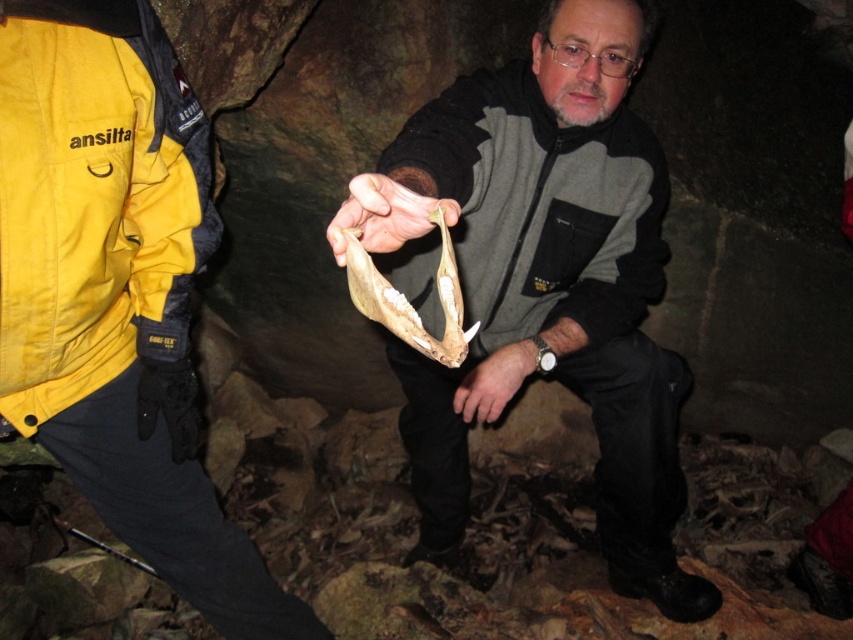
Question: Which point appears farthest from the camera in this image?

Choices:
 (A) (25, 419)
 (B) (372, 195)

Answer: (A)

Question: Which object appears closest to the camera in this image?

Choices:
 (A) matte bone at center
 (B) yellow fabric jacket at left
 (C) matte black jacket at center
 (D) smooth bone at center

Answer: (D)

Question: Which of these objects is positioned farthest from the matte black jacket at center?

Choices:
 (A) yellow fabric jacket at left
 (B) gray fleece jacket at center
 (C) smooth bone at center

Answer: (B)

Question: Is matte black jacket at center positioned at the back of brown leather bone at center?

Choices:
 (A) no
 (B) yes

Answer: (B)

Question: Does matte black jacket at center have a lesser width compared to smooth bone at center?

Choices:
 (A) yes
 (B) no

Answer: (B)

Question: Is matte black jacket at center bigger than brown leather bone at center?

Choices:
 (A) yes
 (B) no

Answer: (A)